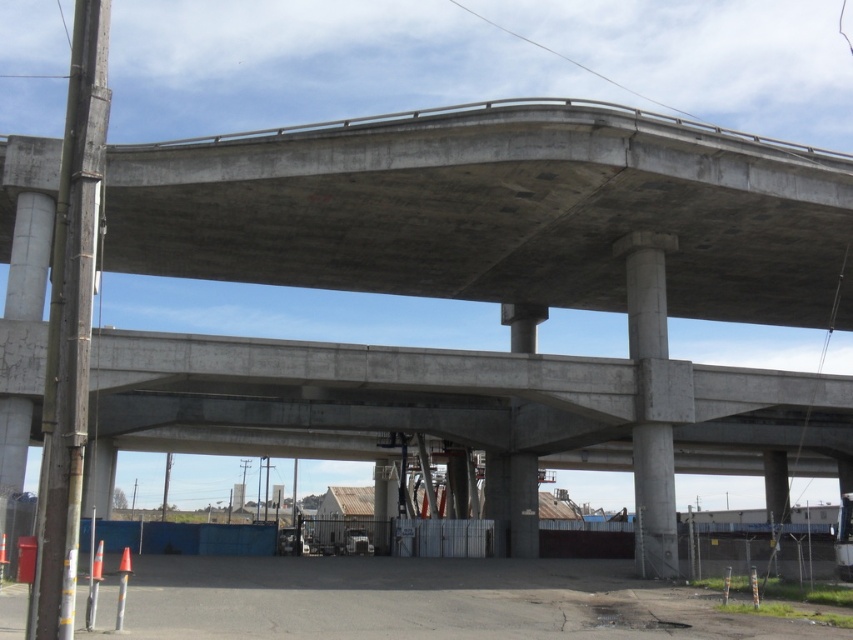
Does concrete highway at lower center have a greater width compared to concrete pole at left?

Yes.

At what (x,y) coordinates should I click in order to perform the action: click on concrete highway at lower center. Please return your answer as a coordinate pair (x, y). Looking at the image, I should click on (421, 602).

Based on the photo, does concrete/rough column at center have a larger size compared to gray concrete pillar at center?

Yes.

Who is more forward, (654, 525) or (534, 493)?

Positioned in front is point (654, 525).

Where is `concrete/rough column at center`? The image size is (853, 640). concrete/rough column at center is located at coordinates (654, 499).

Who is positioned more to the left, concrete highway at lower center or gray concrete pillar at center?

From the viewer's perspective, concrete highway at lower center appears more on the left side.

What do you see at coordinates (421, 602) in the screenshot?
I see `concrete highway at lower center` at bounding box center [421, 602].

Is point (421, 582) positioned before point (524, 516)?

Yes, it is.

At what (x,y) coordinates should I click in order to perform the action: click on concrete highway at lower center. Please return your answer as a coordinate pair (x, y). The height and width of the screenshot is (640, 853). Looking at the image, I should click on (421, 602).